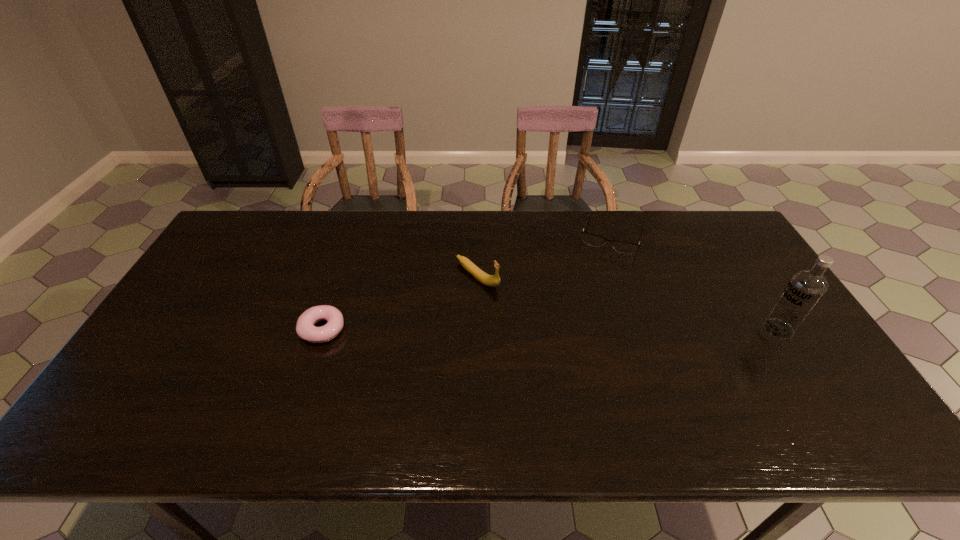
Where is `vacant space on the desktop that is between the doughnut and the rightmost object and is positioned on the front-facing side of the farthest object`? vacant space on the desktop that is between the doughnut and the rightmost object and is positioned on the front-facing side of the farthest object is located at coordinates (582, 329).

Image resolution: width=960 pixels, height=540 pixels. Identify the location of free space on the desktop that is between the leftmost object and the vodka and is positioned at the stem of the third nearest object. (547, 329).